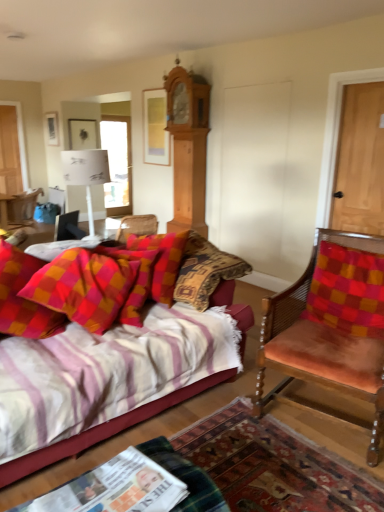
Describe the element at coordinates (360, 161) in the screenshot. I see `light brown wood door at right, which is counted as the second door, starting from the left` at that location.

I want to click on wooden door at left, the second door in the bottom-to-top sequence, so click(x=10, y=151).

From a real-world perspective, between striped fabric couch at lower left and light brown wood door at right, the second door in the back-to-front sequence, who is vertically higher?

light brown wood door at right, the second door in the back-to-front sequence.

Is striped fabric couch at lower left with light brown wood door at right, the second door in the back-to-front sequence?

No.

Is striped fabric couch at lower left not inside light brown wood door at right, which ranks as the first door in bottom-to-top order?

striped fabric couch at lower left lies outside light brown wood door at right, which ranks as the first door in bottom-to-top order,'s area.

Does striped fabric couch at lower left have a smaller size compared to light brown wood door at right, positioned as the first door in right-to-left order?

Actually, striped fabric couch at lower left might be larger than light brown wood door at right, positioned as the first door in right-to-left order.

From the image's perspective, between light brown wood clock at upper center and checkered fabric pillow at right, marked as the first pillow in a right-to-left arrangement, which one is located above?

light brown wood clock at upper center, from the image's perspective.

Is light brown wood clock at upper center positioned behind checkered fabric pillow at right, marked as the first pillow in a right-to-left arrangement?

Yes, it is.

Considering the sizes of light brown wood clock at upper center and checkered fabric pillow at right, positioned as the second pillow in left-to-right order, in the image, is light brown wood clock at upper center bigger or smaller than checkered fabric pillow at right, positioned as the second pillow in left-to-right order,?

In the image, light brown wood clock at upper center appears to be larger than checkered fabric pillow at right, positioned as the second pillow in left-to-right order.

Is striped fabric couch at lower left not near velvet orange chair at right, the 2th chair positioned from the back?

striped fabric couch at lower left is near velvet orange chair at right, the 2th chair positioned from the back, not far away.

Can you confirm if striped fabric couch at lower left is taller than velvet orange chair at right, which ranks as the 1th chair in bottom-to-top order?

No, striped fabric couch at lower left is not taller than velvet orange chair at right, which ranks as the 1th chair in bottom-to-top order.

Can you confirm if striped fabric couch at lower left is smaller than velvet orange chair at right, positioned as the second chair in top-to-bottom order?

Incorrect, striped fabric couch at lower left is not smaller in size than velvet orange chair at right, positioned as the second chair in top-to-bottom order.

Does point (340, 210) come farther from viewer compared to point (181, 106)?

No, it is not.

Can you confirm if light brown wood door at right, which is counted as the first door, starting from the front, is smaller than light brown wood clock at upper center?

Indeed, light brown wood door at right, which is counted as the first door, starting from the front, has a smaller size compared to light brown wood clock at upper center.

Who is more distant, light brown wood door at right, which ranks as the first door in bottom-to-top order, or light brown wood clock at upper center?

light brown wood clock at upper center.

Which of these two, light brown wood door at right, positioned as the first door in right-to-left order, or light brown wood clock at upper center, is thinner?

light brown wood door at right, positioned as the first door in right-to-left order, is thinner.

Which of these two, plush cotton pillow at center-left, the first pillow viewed from the left, or wooden door at left, which is counted as the 1th door, starting from the back, stands shorter?

Standing shorter between the two is plush cotton pillow at center-left, the first pillow viewed from the left.

Is there a large distance between plush cotton pillow at center-left, the first pillow viewed from the left, and wooden door at left, the second door in the bottom-to-top sequence?

That's right, there is a large distance between plush cotton pillow at center-left, the first pillow viewed from the left, and wooden door at left, the second door in the bottom-to-top sequence.

In the scene shown: Would you say plush cotton pillow at center-left, the first pillow viewed from the left, is to the left or to the right of wooden door at left, the first door when ordered from left to right, in the picture?

In the image, plush cotton pillow at center-left, the first pillow viewed from the left, appears on the right side of wooden door at left, the first door when ordered from left to right.

From the image's perspective, is plush cotton pillow at center-left, the first pillow viewed from the left, positioned above or below wooden door at left, placed as the second door when sorted from right to left?

plush cotton pillow at center-left, the first pillow viewed from the left, is below wooden door at left, placed as the second door when sorted from right to left.

Considering the relative sizes of wooden door at left, which is counted as the 1th door, starting from the back, and striped fabric couch at lower left in the image provided, is wooden door at left, which is counted as the 1th door, starting from the back, shorter than striped fabric couch at lower left?

Incorrect, the height of wooden door at left, which is counted as the 1th door, starting from the back, does not fall short of that of striped fabric couch at lower left.

Is wooden door at left, the second door in the bottom-to-top sequence, to the right of striped fabric couch at lower left from the viewer's perspective?

No.

Looking at this image, can you confirm if wooden door at left, which is counted as the 1th door, starting from the back, is smaller than striped fabric couch at lower left?

Yes, wooden door at left, which is counted as the 1th door, starting from the back, is smaller than striped fabric couch at lower left.

From the picture: From a real-world perspective, is wooden door at left, which is counted as the 1th door, starting from the back, on striped fabric couch at lower left?

Yes, from a real-world perspective, wooden door at left, which is counted as the 1th door, starting from the back, is above striped fabric couch at lower left.

Where is `chair in front of the white paper lampshade at upper center`? chair in front of the white paper lampshade at upper center is located at coordinates (331, 324).

Are velvet orange chair at right, positioned as the second chair in top-to-bottom order, and white paper lampshade at upper center far apart?

velvet orange chair at right, positioned as the second chair in top-to-bottom order, is positioned a significant distance from white paper lampshade at upper center.

How many degrees apart are the facing directions of velvet orange chair at right, placed as the first chair when sorted from front to back, and white paper lampshade at upper center?

107 degrees separate the facing orientations of velvet orange chair at right, placed as the first chair when sorted from front to back, and white paper lampshade at upper center.

In the scene shown: Relative to white paper lampshade at upper center, is velvet orange chair at right, the 2th chair positioned from the back, in front or behind?

Clearly, velvet orange chair at right, the 2th chair positioned from the back, is in front of white paper lampshade at upper center.

Where is `studio couch below the light brown wood door at right, positioned as the first door in right-to-left order (from the image's perspective)`? studio couch below the light brown wood door at right, positioned as the first door in right-to-left order (from the image's perspective) is located at coordinates (103, 430).

There is a checkered fabric pillow at right, positioned as the second pillow in left-to-right order. Identify the location of clock above it (from a real-world perspective). (188, 146).

Looking at the image, which one is located closer to plush cotton pillow at center-left, the first pillow viewed from the left, light brown wood clock at upper center or black plastic phone at lower left?

The object closer to plush cotton pillow at center-left, the first pillow viewed from the left, is black plastic phone at lower left.

Which object lies further to the anchor point velvet orange chair at right, which appears as the 2th chair when viewed from the left, checkered fabric pillow at right, marked as the first pillow in a right-to-left arrangement, or black plastic phone at lower left?

black plastic phone at lower left is further to velvet orange chair at right, which appears as the 2th chair when viewed from the left.

When comparing their distances from light brown wood clock at upper center, does velvet orange chair at right, acting as the first chair starting from the right, or checkered fabric pillow at right, marked as the first pillow in a right-to-left arrangement, seem further?

velvet orange chair at right, acting as the first chair starting from the right.

Based on their spatial positions, is light brown wood clock at upper center or white paper lampshade at upper center further from checkered fabric pillow at right, marked as the first pillow in a right-to-left arrangement?

light brown wood clock at upper center is positioned further to the anchor checkered fabric pillow at right, marked as the first pillow in a right-to-left arrangement.

Looking at this image, looking at the image, which one is located closer to black plastic phone at lower left, plush cotton pillow at center-left, the second pillow viewed from the right, or striped fabric couch at lower left?

plush cotton pillow at center-left, the second pillow viewed from the right, is positioned closer to the anchor black plastic phone at lower left.

Looking at the image, which one is located further to light brown wood clock at upper center, wooden door at left, which ranks as the 2th door in front-to-back order, or white glossy magazine at lower center?

white glossy magazine at lower center lies further to light brown wood clock at upper center than the other object.

Which object lies nearer to the anchor point white paper lampshade at upper center, light brown wood clock at upper center or white glossy magazine at lower center?

The object closer to white paper lampshade at upper center is light brown wood clock at upper center.

Which object lies further to the anchor point light brown wood door at right, the second door in the back-to-front sequence, plush cotton pillow at center-left, the second pillow viewed from the right, or light brown wood clock at upper center?

Based on the image, plush cotton pillow at center-left, the second pillow viewed from the right, appears to be further to light brown wood door at right, the second door in the back-to-front sequence.

Find the location of `magazine between black plastic phone at lower left and light brown wood door at right, positioned as the first door in right-to-left order, in the horizontal direction`. magazine between black plastic phone at lower left and light brown wood door at right, positioned as the first door in right-to-left order, in the horizontal direction is located at coordinates (115, 488).

Where is `studio couch between plush cotton pillow at center-left, the first pillow viewed from the left, and light brown wood door at right, which is counted as the second door, starting from the left`? The height and width of the screenshot is (512, 384). studio couch between plush cotton pillow at center-left, the first pillow viewed from the left, and light brown wood door at right, which is counted as the second door, starting from the left is located at coordinates (103, 430).

You are a GUI agent. You are given a task and a screenshot of the screen. Output one action in this format:
    pyautogui.click(x=<x>, y=<y>)
    Task: Click on the studio couch between white glossy magazine at lower center and black plastic phone at lower left along the z-axis
    
    Given the screenshot: What is the action you would take?
    click(103, 430)

Find the location of a particular element. Image resolution: width=384 pixels, height=512 pixels. clock positioned between striped fabric couch at lower left and velvet pink chair at left, the 2th chair positioned from the front, from near to far is located at coordinates (188, 146).